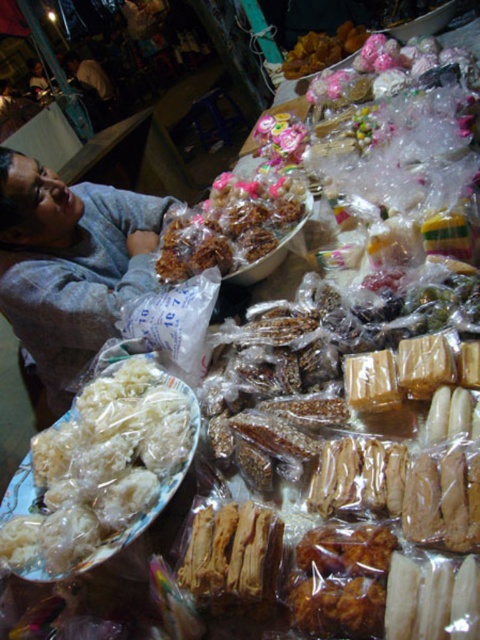
Question: Can you confirm if translucent plastic wrapped at lower left is wider than brown/crumbly pastry at center?

Choices:
 (A) yes
 (B) no

Answer: (B)

Question: Does translucent plastic wrapped at lower left have a lesser width compared to brown/crumbly pastry at center?

Choices:
 (A) yes
 (B) no

Answer: (A)

Question: Is translucent plastic wrapped at lower left above brown/crumbly pastry at center?

Choices:
 (A) yes
 (B) no

Answer: (B)

Question: Which object is closer to the camera taking this photo?

Choices:
 (A) brown/crumbly pastry at center
 (B) translucent plastic wrapped at lower left

Answer: (B)